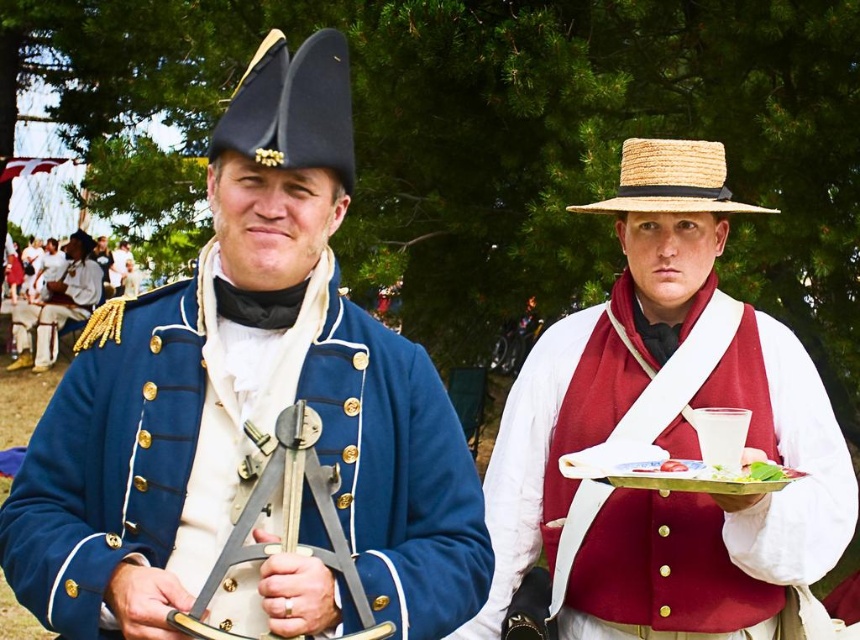
Who is shorter, blue woolen coat at center or matte black tricorn hat at upper left?

Standing shorter between the two is matte black tricorn hat at upper left.

Who is taller, blue woolen coat at center or matte black tricorn hat at upper left?

Standing taller between the two is blue woolen coat at center.

Who is more distant from viewer, (84, 564) or (89, 244)?

Point (89, 244)

Where is `blue woolen coat at center`? The image size is (860, 640). blue woolen coat at center is located at coordinates (246, 397).

Consider the image. Can you confirm if matte straw hat at center is taller than white cotton shirt at left?

Yes.

Between matte straw hat at center and white cotton shirt at left, which one is positioned higher?

Positioned higher is white cotton shirt at left.

Between point (784, 557) and point (66, 298), which one is positioned in front?

Point (784, 557) is in front.

You are a GUI agent. You are given a task and a screenshot of the screen. Output one action in this format:
    pyautogui.click(x=<x>, y=<y>)
    Task: Click on the matte straw hat at center
    
    Given the screenshot: What is the action you would take?
    pos(664,435)

Who is shorter, matte straw hat at center or strawmaterial/texturehat at upper right?

strawmaterial/texturehat at upper right is shorter.

Between matte straw hat at center and strawmaterial/texturehat at upper right, which one is positioned higher?

strawmaterial/texturehat at upper right is above.

Consider the image. Who is more forward, [662,596] or [645,163]?

Point [662,596] is more forward.

Where is `matte straw hat at center`? The height and width of the screenshot is (640, 860). matte straw hat at center is located at coordinates tap(664, 435).